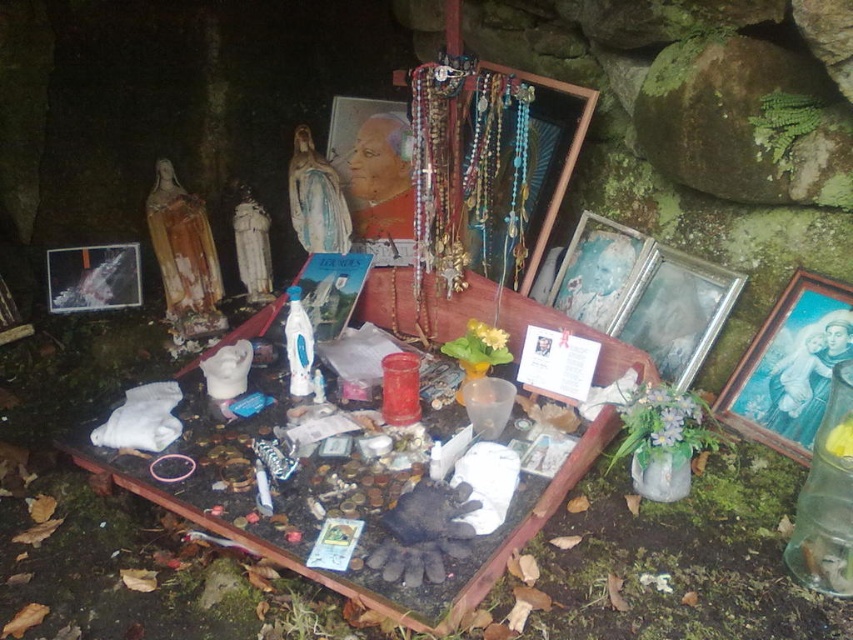
You are standing in front of the shrine and want to place a small offering. There are two points marked on the shrine where you can place it. Which point is closer to you, point (x=606, y=317) or point (x=703, y=404)?

Point (x=703, y=404) is closer to you because point (x=606, y=317) is behind it.

You are standing in front of the shrine and notice a point marked at coordinates (x=676, y=310). Which object from the shrine does this point belong to?

The point at coordinates (x=676, y=310) belongs to the metallic silver picture frame at right.